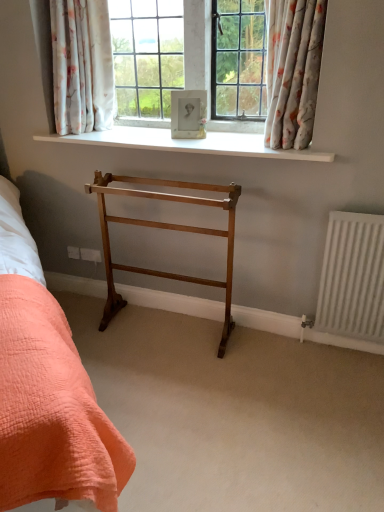
Locate an element on the screen. free spot above white matte radiator at right (from a real-world perspective) is located at coordinates (359, 206).